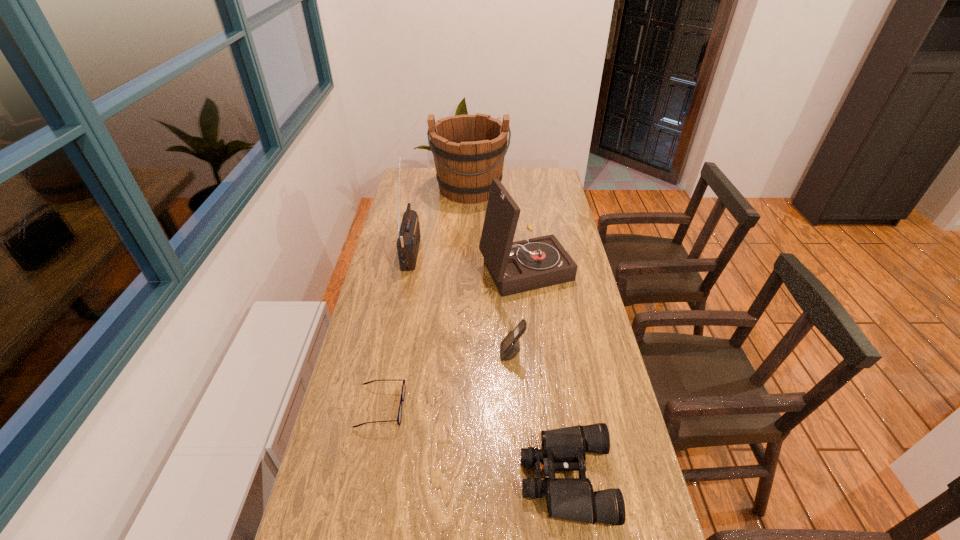
In order to click on free space located 0.370m on the side of the wine bucket with the handle for carrying in this screenshot , I will do `click(468, 260)`.

Locate an element on the screen. This screenshot has width=960, height=540. vacant space located 0.160m on the front-facing side of the radio receiver is located at coordinates (460, 251).

The image size is (960, 540). What are the coordinates of `vacant space located 0.220m on the front-facing side of the fourth farthest object` in the screenshot? It's located at (427, 353).

At what (x,y) coordinates should I click in order to perform the action: click on vacant point located on the front-facing side of the fourth farthest object. Please return your answer as a coordinate pair (x, y). Looking at the image, I should click on (467, 353).

Identify the location of free region located 0.320m on the front-facing side of the fourth farthest object. This screenshot has width=960, height=540. (394, 353).

This screenshot has width=960, height=540. I want to click on free point located through the eyepieces of the nearest object, so click(x=499, y=478).

This screenshot has width=960, height=540. What are the coordinates of `vacant area situated 0.350m through the eyepieces of the nearest object` in the screenshot? It's located at (373, 478).

You are a GUI agent. You are given a task and a screenshot of the screen. Output one action in this format:
    pyautogui.click(x=<x>, y=<y>)
    Task: Click on the vacant space located 0.120m through the eyepieces of the nearest object
    The image size is (960, 540).
    Given the screenshot: What is the action you would take?
    pyautogui.click(x=470, y=478)

The image size is (960, 540). I want to click on free spot located 0.340m on the front-facing side of the second nearest object, so click(530, 407).

What are the coordinates of `object located at the far edge` in the screenshot? It's located at (469, 150).